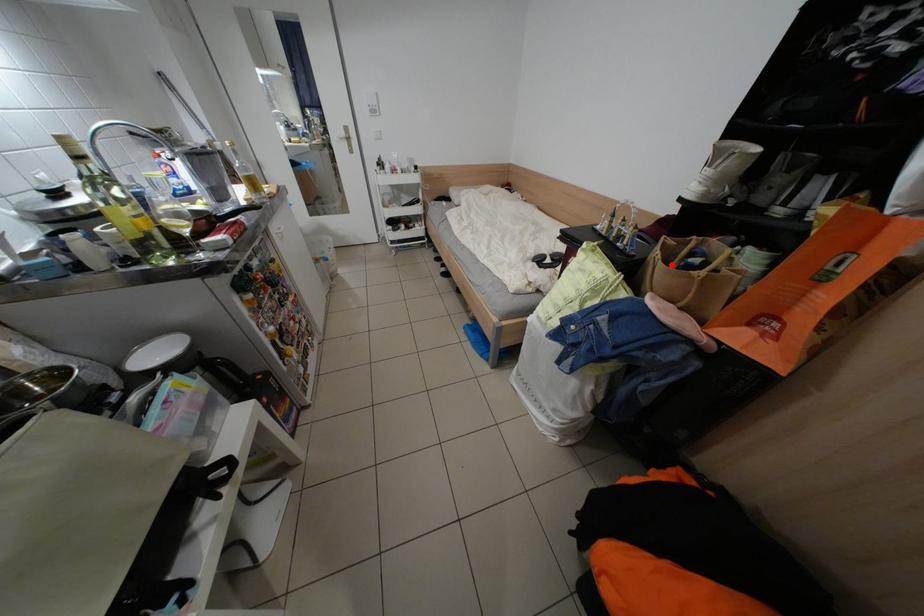
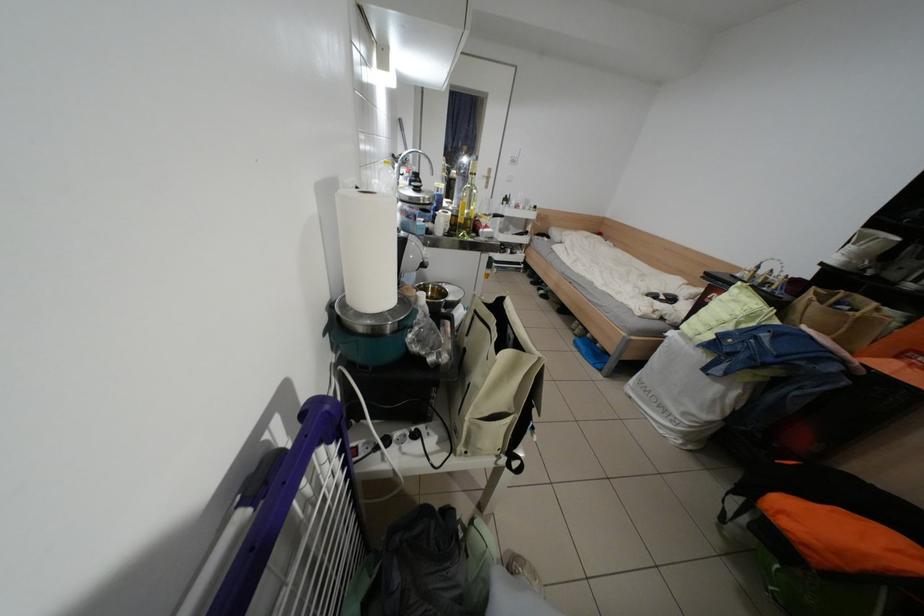
Locate, in the second image, the point that corresponds to the highlighted location in the first image.

(827, 305)